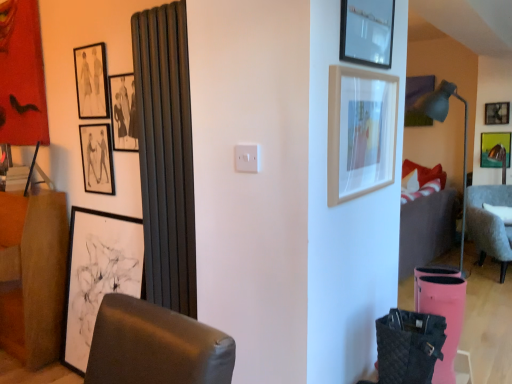
What do you see at coordinates (97, 158) in the screenshot? The height and width of the screenshot is (384, 512). I see `matte black picture frame at upper left, which ranks as the 6th picture frame in front-to-back order` at bounding box center [97, 158].

Measure the distance between point (x=80, y=93) and camera.

They are 2.44 meters apart.

How much space does white matte picture frame at left, arranged as the third picture frame when viewed from the left, occupy horizontally?

It is 7.54 inches.

Locate an element on the screen. This screenshot has height=384, width=512. matte black picture frame at upper center, the 7th picture frame viewed from the back is located at coordinates (367, 32).

The height and width of the screenshot is (384, 512). I want to click on matte black picture frame at upper left, which ranks as the 6th picture frame in front-to-back order, so click(97, 158).

From the image's perspective, which one is positioned lower, matte black picture frame at upper left, which ranks as the 6th picture frame in front-to-back order, or matte black radiator at left?

matte black radiator at left, from the image's perspective.

Is matte black picture frame at upper left, positioned as the 7th picture frame in right-to-left order, not near matte black radiator at left?

Actually, matte black picture frame at upper left, positioned as the 7th picture frame in right-to-left order, and matte black radiator at left are a little close together.

Between matte black picture frame at upper left, which ranks as the third picture frame in back-to-front order, and matte black radiator at left, which one has smaller size?

matte black picture frame at upper left, which ranks as the third picture frame in back-to-front order, is smaller.

Which is closer, (83, 210) or (485, 256)?

Positioned in front is point (83, 210).

How different are the orientations of white matte picture frame at left, marked as the 6th picture frame in a back-to-front arrangement, and gray fabric chair at right in degrees?

white matte picture frame at left, marked as the 6th picture frame in a back-to-front arrangement, and gray fabric chair at right are facing 37.5 degrees away from each other.

From a real-world perspective, count 1st picture frames upward from the gray fabric chair at right and point to it. Please provide its 2D coordinates.

[(98, 274)]

Considering the sizes of objects white matte picture frame at left, arranged as the third picture frame when viewed from the left, and gray fabric chair at right in the image provided, who is shorter, white matte picture frame at left, arranged as the third picture frame when viewed from the left, or gray fabric chair at right?

gray fabric chair at right.

Which is farther from the camera, (489, 124) or (353, 101)?

Positioned behind is point (489, 124).

Is light wood picture frame at upper right, acting as the first picture frame starting from the front, at the back of metallic silver picture frame at upper right, which is the seventh picture frame from front to back?

No, light wood picture frame at upper right, acting as the first picture frame starting from the front, is not at the back of metallic silver picture frame at upper right, which is the seventh picture frame from front to back.

Which of these two, metallic silver picture frame at upper right, which is the second picture frame in back-to-front order, or light wood picture frame at upper right, the 4th picture frame from the right, stands taller?

light wood picture frame at upper right, the 4th picture frame from the right, is taller.

Considering their positions, is matte black picture frame at upper center, which is the 3th picture frame from right to left, located in front of or behind light wood picture frame at upper right, which ranks as the fifth picture frame in left-to-right order?

In the image, matte black picture frame at upper center, which is the 3th picture frame from right to left, appears behind light wood picture frame at upper right, which ranks as the fifth picture frame in left-to-right order.

In terms of height, does matte black picture frame at upper center, the sixth picture frame when ordered from left to right, look taller or shorter compared to light wood picture frame at upper right, the 4th picture frame from the right?

Clearly, matte black picture frame at upper center, the sixth picture frame when ordered from left to right, is shorter compared to light wood picture frame at upper right, the 4th picture frame from the right.

Does matte black picture frame at upper center, which ranks as the 2th picture frame in front-to-back order, have a greater width compared to light wood picture frame at upper right, the eighth picture frame positioned from the back?

No, matte black picture frame at upper center, which ranks as the 2th picture frame in front-to-back order, is not wider than light wood picture frame at upper right, the eighth picture frame positioned from the back.

How different are the orientations of matte black picture frame at upper center, the sixth picture frame when ordered from left to right, and light wood picture frame at upper right, the eighth picture frame positioned from the back, in degrees?

0.237 degrees.

Can you confirm if metallic silver picture frame at upper right, the second picture frame when ordered from right to left, is thinner than matte black picture frame at upper center, which ranks as the 2th picture frame in front-to-back order?

No, metallic silver picture frame at upper right, the second picture frame when ordered from right to left, is not thinner than matte black picture frame at upper center, which ranks as the 2th picture frame in front-to-back order.

From the image's perspective, between metallic silver picture frame at upper right, the second picture frame when ordered from right to left, and matte black picture frame at upper center, which is the 3th picture frame from right to left, who is located below?

From the image's view, matte black picture frame at upper center, which is the 3th picture frame from right to left, is below.

How different are the orientations of metallic silver picture frame at upper right, the second picture frame when ordered from right to left, and matte black picture frame at upper center, which is the 3th picture frame from right to left, in degrees?

The facing directions of metallic silver picture frame at upper right, the second picture frame when ordered from right to left, and matte black picture frame at upper center, which is the 3th picture frame from right to left, are 90.3 degrees apart.

Considering the relative sizes of metallic silver picture frame at upper right, which is the second picture frame in back-to-front order, and matte black picture frame at upper center, which ranks as the 2th picture frame in front-to-back order, in the image provided, is metallic silver picture frame at upper right, which is the second picture frame in back-to-front order, bigger than matte black picture frame at upper center, which ranks as the 2th picture frame in front-to-back order,?

No.

From a real-world perspective, is matte black radiator at left positioned under matte black picture frame at upper left, the 4th picture frame positioned from the front, based on gravity?

Yes, from a real-world perspective, matte black radiator at left is below matte black picture frame at upper left, the 4th picture frame positioned from the front.

Between matte black radiator at left and matte black picture frame at upper left, arranged as the fifth picture frame when viewed from the right, which one has larger size?

With larger size is matte black radiator at left.

Based on the photo, can you confirm if matte black radiator at left is positioned to the left of matte black picture frame at upper left, the fifth picture frame in the back-to-front sequence?

No.

Looking at this image, which of these two, matte black picture frame at upper center, the sixth picture frame when ordered from left to right, or matte black picture frame at upper left, the 4th picture frame positioned from the front, is bigger?

Bigger between the two is matte black picture frame at upper center, the sixth picture frame when ordered from left to right.

Does matte black picture frame at upper center, which is the 3th picture frame from right to left, lie behind matte black picture frame at upper left, the 4th picture frame from the left?

No, the depth of matte black picture frame at upper center, which is the 3th picture frame from right to left, is less than that of matte black picture frame at upper left, the 4th picture frame from the left.

Is matte black picture frame at upper center, which ranks as the 2th picture frame in front-to-back order, oriented away from matte black picture frame at upper left, the 4th picture frame positioned from the front?

Yes, matte black picture frame at upper center, which ranks as the 2th picture frame in front-to-back order,'s orientation is away from matte black picture frame at upper left, the 4th picture frame positioned from the front.

Does matte black picture frame at upper center, the sixth picture frame when ordered from left to right, have a lesser height compared to matte black picture frame at upper left, arranged as the fifth picture frame when viewed from the right?

Correct, matte black picture frame at upper center, the sixth picture frame when ordered from left to right, is not as tall as matte black picture frame at upper left, arranged as the fifth picture frame when viewed from the right.

The image size is (512, 384). Identify the location of the 1st picture frame directly above the matte black radiator at left (from a real-world perspective). tap(97, 158).

Where is `picture frame below the gray fabric chair at right (from the image's perspective)`? picture frame below the gray fabric chair at right (from the image's perspective) is located at coordinates (x=98, y=274).

When comparing their distances from light wood picture frame at upper right, which ranks as the fifth picture frame in left-to-right order, does matte black picture frame at upper left, the fifth picture frame in the back-to-front sequence, or metallic silver picture frame at upper right, the seventh picture frame viewed from the left, seem closer?

Among the two, matte black picture frame at upper left, the fifth picture frame in the back-to-front sequence, is located nearer to light wood picture frame at upper right, which ranks as the fifth picture frame in left-to-right order.

From the image, which object appears to be nearer to metallic silver picture frame at upper right, the second picture frame when ordered from right to left, white matte picture frame at left, arranged as the third picture frame when viewed from the left, or matte yellow picture frame at upper right, which appears as the 1th picture frame when viewed from the right?

matte yellow picture frame at upper right, which appears as the 1th picture frame when viewed from the right, lies closer to metallic silver picture frame at upper right, the second picture frame when ordered from right to left, than the other object.

Estimate the real-world distances between objects in this image. Which object is further from gray fabric chair at right, matte gray floor lamp at right or matte black picture frame at upper left, which appears as the 1th picture frame when viewed from the left?

matte black picture frame at upper left, which appears as the 1th picture frame when viewed from the left, is further to gray fabric chair at right.

From the image, which object appears to be nearer to gray fabric chair at right, matte gray floor lamp at right or matte black radiator at left?

→ Among the two, matte gray floor lamp at right is located nearer to gray fabric chair at right.

From the picture: Looking at the image, which one is located further to metallic silver picture frame at upper right, which is the seventh picture frame from front to back, matte black picture frame at upper left, the fifth picture frame in the back-to-front sequence, or matte black picture frame at upper left, the eighth picture frame positioned from the right?

Based on the image, matte black picture frame at upper left, the eighth picture frame positioned from the right, appears to be further to metallic silver picture frame at upper right, which is the seventh picture frame from front to back.

Based on their spatial positions, is matte black picture frame at upper center, the sixth picture frame when ordered from left to right, or gray fabric chair at right closer to matte black picture frame at upper left, which ranks as the fifth picture frame in front-to-back order?

Based on the image, matte black picture frame at upper center, the sixth picture frame when ordered from left to right, appears to be nearer to matte black picture frame at upper left, which ranks as the fifth picture frame in front-to-back order.

Considering their positions, is matte gray floor lamp at right positioned further to gray fabric chair at right than light wood picture frame at upper right, acting as the first picture frame starting from the front?

light wood picture frame at upper right, acting as the first picture frame starting from the front, is positioned further to the anchor gray fabric chair at right.

Based on their spatial positions, is matte black picture frame at upper left, which ranks as the 6th picture frame in front-to-back order, or matte gray floor lamp at right further from gray fabric chair at right?

matte black picture frame at upper left, which ranks as the 6th picture frame in front-to-back order.

Locate an element on the screen. curtain situated between white matte picture frame at left, which is the 6th picture frame from right to left, and matte black picture frame at upper center, the sixth picture frame when ordered from left to right, from left to right is located at coordinates (166, 155).

Identify the location of chair between matte black picture frame at upper left, the fifth picture frame in the back-to-front sequence, and matte yellow picture frame at upper right, the 1th picture frame positioned from the back, from left to right. The image size is (512, 384). (489, 224).

This screenshot has height=384, width=512. Find the location of `chair between brown fabric dresser at left and metallic silver picture frame at upper right, the seventh picture frame viewed from the left`. chair between brown fabric dresser at left and metallic silver picture frame at upper right, the seventh picture frame viewed from the left is located at coordinates (489, 224).

You are a GUI agent. You are given a task and a screenshot of the screen. Output one action in this format:
    pyautogui.click(x=<x>, y=<y>)
    Task: Click on the curtain between matte black picture frame at upper left, the fifth picture frame in the back-to-front sequence, and metallic silver picture frame at upper right, the seventh picture frame viewed from the left
    Image resolution: width=512 pixels, height=384 pixels.
    Given the screenshot: What is the action you would take?
    pyautogui.click(x=166, y=155)